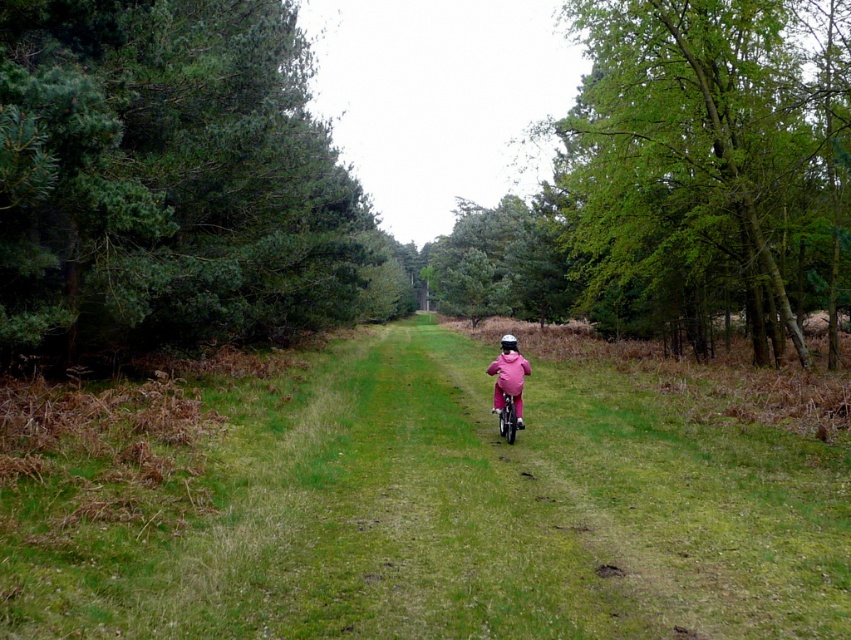
Looking at this image, can you confirm if pink matte jacket at center is thinner than pink matte bicycle at center?

Incorrect, pink matte jacket at center's width is not less than pink matte bicycle at center's.

Is pink matte jacket at center taller than pink matte bicycle at center?

Yes, pink matte jacket at center is taller than pink matte bicycle at center.

Where is `pink matte jacket at center`? Image resolution: width=851 pixels, height=640 pixels. pink matte jacket at center is located at coordinates (507, 376).

Consider the image. Is green leafy tree at right shorter than pink matte bicycle at center?

Incorrect, green leafy tree at right's height does not fall short of pink matte bicycle at center's.

Between green leafy tree at right and pink matte bicycle at center, which one is positioned higher?

green leafy tree at right

The width and height of the screenshot is (851, 640). Find the location of `green leafy tree at right`. green leafy tree at right is located at coordinates (711, 156).

Image resolution: width=851 pixels, height=640 pixels. Describe the element at coordinates (170, 180) in the screenshot. I see `green textured pine trees at left` at that location.

Does point (67, 38) lie in front of point (721, 276)?

Yes, it is in front of point (721, 276).

The image size is (851, 640). Find the location of `green textured pine trees at left`. green textured pine trees at left is located at coordinates (170, 180).